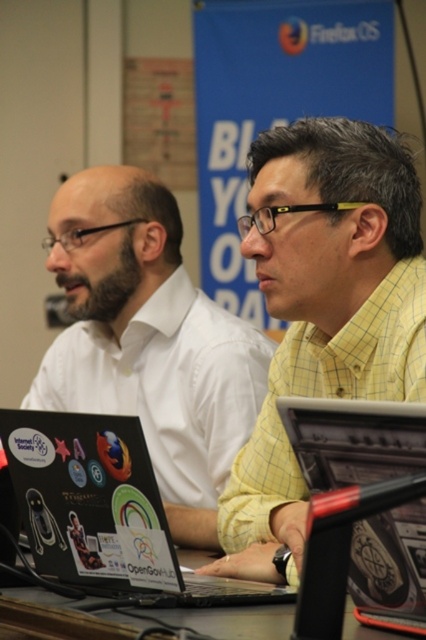
Question: Can you confirm if yellow checkered shirt at center is positioned above sticker-covered plastic laptop at center?

Choices:
 (A) no
 (B) yes

Answer: (B)

Question: Is metallic silver laptop at center further to the viewer compared to black plastic table at lower center?

Choices:
 (A) no
 (B) yes

Answer: (A)

Question: Is metallic silver laptop at center thinner than black plastic table at lower center?

Choices:
 (A) no
 (B) yes

Answer: (B)

Question: Which point is closer to the camera?

Choices:
 (A) (207, 384)
 (B) (149, 580)

Answer: (B)

Question: Which point is farther to the camera?

Choices:
 (A) metallic silver laptop at center
 (B) yellow checkered shirt at center
 (C) black plastic table at lower center

Answer: (B)

Question: Which of the following is the farthest from the observer?

Choices:
 (A) (x=178, y=353)
 (B) (x=5, y=595)
 (C) (x=123, y=522)

Answer: (A)